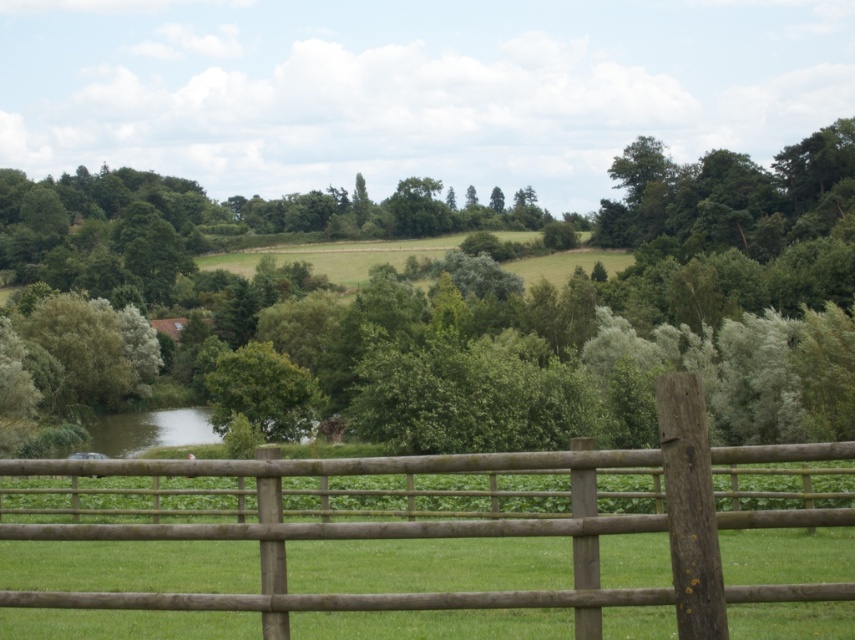
Question: Which point is closer to the camera?

Choices:
 (A) (156, 609)
 (B) (105, 426)
 (C) (295, 385)

Answer: (A)

Question: Does brown wooden fence at center have a larger size compared to green leafy tree at center?

Choices:
 (A) no
 (B) yes

Answer: (A)

Question: Does green leafy tree at center have a lesser width compared to green grassy river at lower left?

Choices:
 (A) yes
 (B) no

Answer: (B)

Question: Estimate the real-world distances between objects in this image. Which object is closer to the green grassy river at lower left?

Choices:
 (A) green leafy tree at center
 (B) brown wooden fence at center

Answer: (A)

Question: Can you confirm if brown wooden fence at center is positioned above green grassy river at lower left?

Choices:
 (A) no
 (B) yes

Answer: (B)

Question: Estimate the real-world distances between objects in this image. Which object is closer to the brown wooden fence at center?

Choices:
 (A) green grassy river at lower left
 (B) green leafy tree at center

Answer: (B)